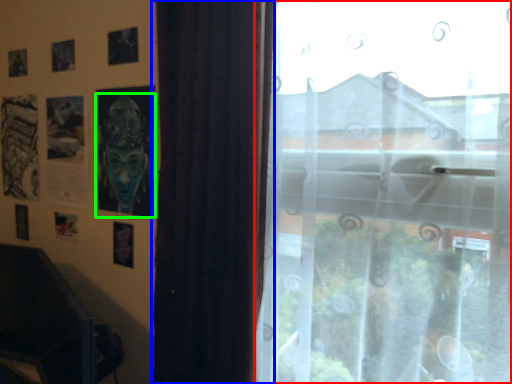
Question: Which object is positioned closest to window (highlighted by a red box)? Select from curtain (highlighted by a blue box) and person (highlighted by a green box).

Choices:
 (A) curtain
 (B) person

Answer: (A)